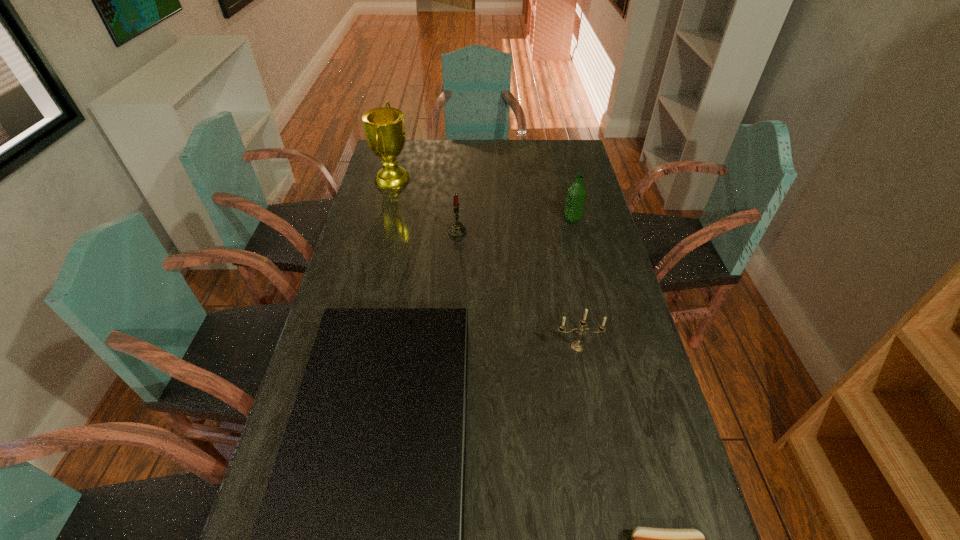
This screenshot has height=540, width=960. Find the location of `the farthest object`. the farthest object is located at coordinates (384, 128).

Identify the location of award. pos(384,128).

Identify the location of the fifth nearest object. This screenshot has height=540, width=960. tap(576, 193).

The width and height of the screenshot is (960, 540). In order to click on the farther candle in this screenshot , I will do `click(457, 230)`.

The height and width of the screenshot is (540, 960). Identify the location of the left candle. (457, 230).

The height and width of the screenshot is (540, 960). Find the location of `the nearer candle`. the nearer candle is located at coordinates (577, 346).

At what (x,y) coordinates should I click in order to perform the action: click on vacant point located on the shiny surface of the award. Please return your answer as a coordinate pair (x, y). Looking at the image, I should click on (505, 178).

Where is `vacant space situated 0.250m on the front of the second farthest object`? This screenshot has height=540, width=960. vacant space situated 0.250m on the front of the second farthest object is located at coordinates (585, 273).

You are a GUI agent. You are given a task and a screenshot of the screen. Output one action in this format:
    pyautogui.click(x=<x>, y=<y>)
    Task: Click on the free spot located 0.090m on the left of the third farthest object
    The height and width of the screenshot is (540, 960).
    Given the screenshot: What is the action you would take?
    point(423,232)

Identify the location of vacant area situated on the front of the nearer candle. (583, 374).